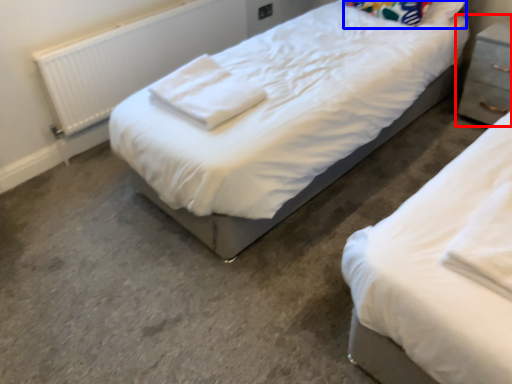
Question: Which point is closer to the camera, nightstand (highlighted by a red box) or pillow (highlighted by a blue box)?

Choices:
 (A) nightstand
 (B) pillow

Answer: (A)